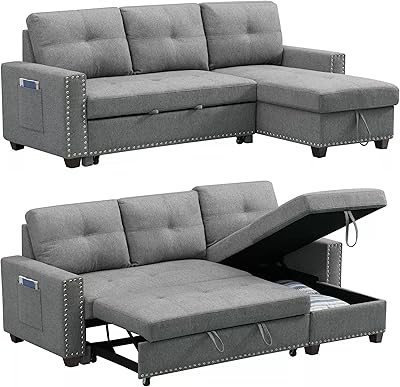
Identify the location of cushion. This screenshot has height=387, width=400. (81, 221), (175, 249), (225, 222), (97, 30), (165, 42), (232, 35).